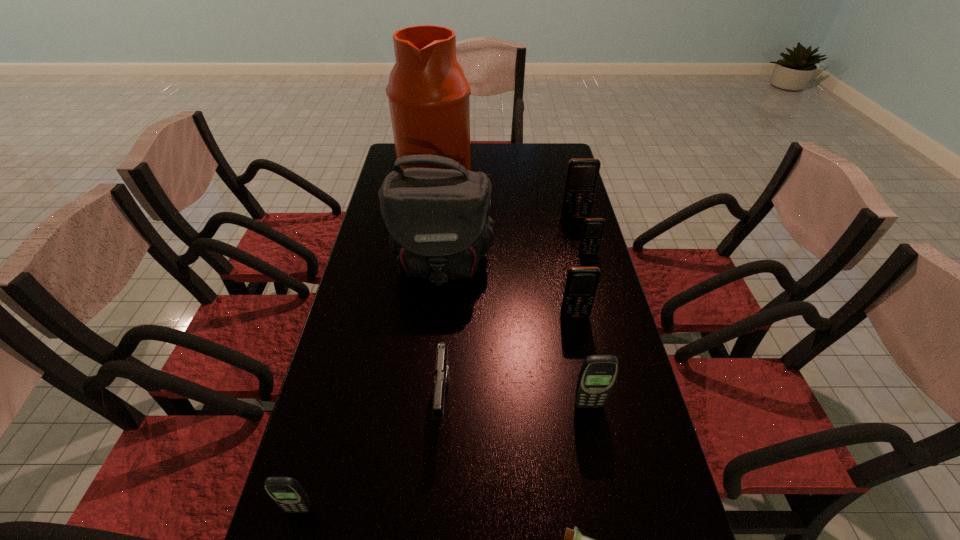
Locate an element on the screen. the fourth nearest cellular telephone is located at coordinates (593, 228).

At what (x,y) coordinates should I click in order to perform the action: click on the second farthest orange cellular telephone. Please return your answer as a coordinate pair (x, y). This screenshot has height=540, width=960. Looking at the image, I should click on (593, 228).

Where is `the nearest cellular telephone`? the nearest cellular telephone is located at coordinates (286, 492).

Where is `the nearer gray cellular telephone`? The image size is (960, 540). the nearer gray cellular telephone is located at coordinates (286, 492).

Where is `pistol`? pistol is located at coordinates (442, 371).

The width and height of the screenshot is (960, 540). Find the location of `free region located from the spout of the orange water jug`. free region located from the spout of the orange water jug is located at coordinates (518, 179).

Image resolution: width=960 pixels, height=540 pixels. What are the coordinates of `vacant space located 0.230m on the open flap of the second tallest object` in the screenshot? It's located at (431, 366).

The image size is (960, 540). Find the location of `vacant space situated 0.080m on the screen of the biggest orange cellular telephone`. vacant space situated 0.080m on the screen of the biggest orange cellular telephone is located at coordinates (580, 234).

Locate an element on the screen. The height and width of the screenshot is (540, 960). free spot located 0.070m on the screen of the right gray cellular telephone is located at coordinates (595, 437).

I want to click on vacant space situated on the screen of the fifth nearest object, so click(584, 358).